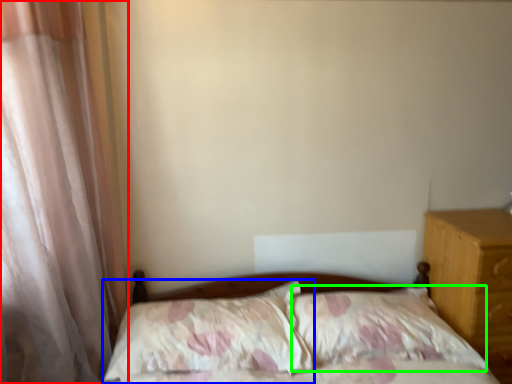
Question: Which object is positioned closest to curtain (highlighted by a red box)? Select from pillow (highlighted by a blue box) and pillow (highlighted by a green box).

Choices:
 (A) pillow
 (B) pillow

Answer: (A)